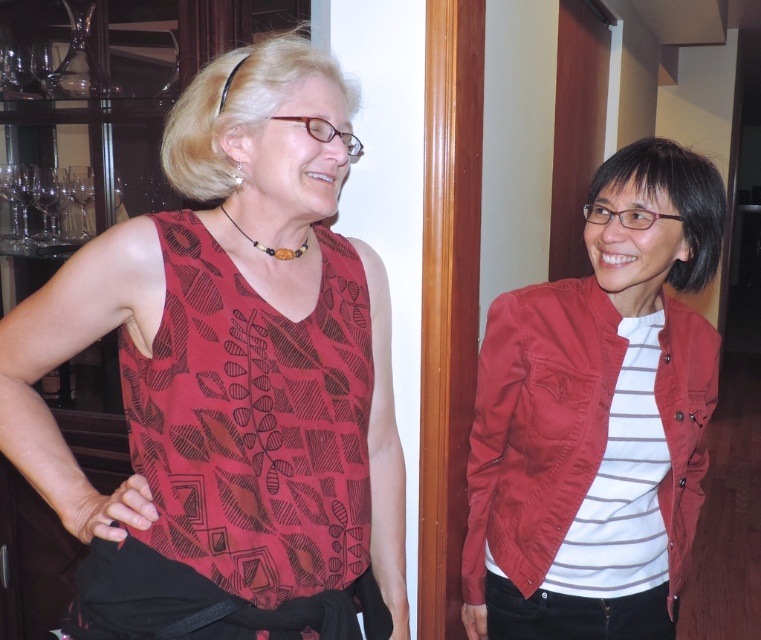
Is matte red jacket at right closer to camera compared to white striped fabric shirt at right?

Yes, matte red jacket at right is closer to the viewer.

Locate an element on the screen. The height and width of the screenshot is (640, 761). matte red jacket at right is located at coordinates (537, 426).

Image resolution: width=761 pixels, height=640 pixels. I want to click on matte red jacket at right, so pyautogui.click(x=537, y=426).

Describe the element at coordinates (231, 380) in the screenshot. I see `matte red tank top at left` at that location.

In order to click on matte red tank top at left in this screenshot , I will do `click(231, 380)`.

Looking at this image, who is taller, matte red tank top at left or white striped fabric shirt at right?

Standing taller between the two is matte red tank top at left.

Is the position of matte red tank top at left less distant than that of white striped fabric shirt at right?

Yes.

Does point (368, 451) come in front of point (661, 422)?

Yes, it is in front of point (661, 422).

Identify the location of matte red tank top at left. (231, 380).